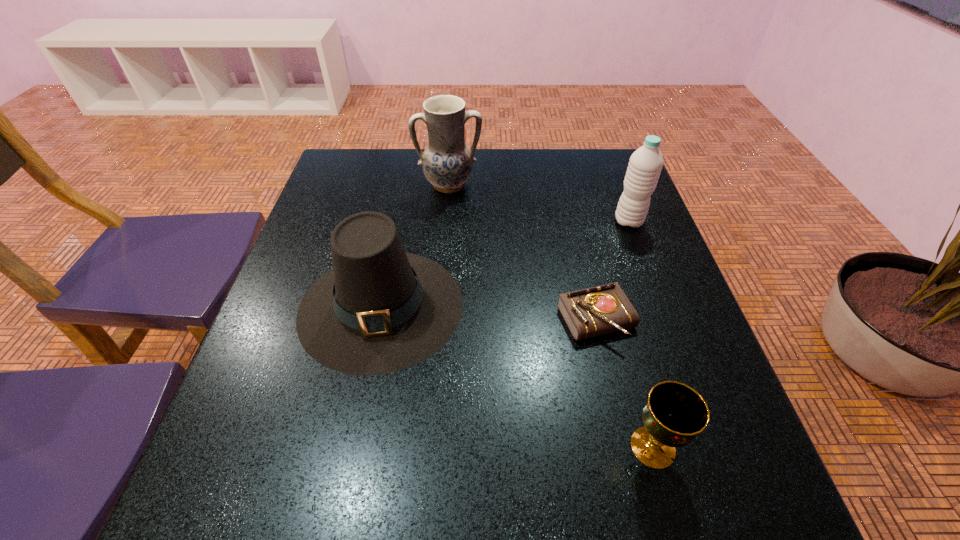
Locate an element on the screen. free space located 0.340m on the left of the chalice is located at coordinates (418, 447).

Image resolution: width=960 pixels, height=540 pixels. In order to click on free location located on the front of the diary in this screenshot , I will do `click(612, 389)`.

I want to click on object positioned at the far edge, so click(447, 162).

Where is `object that is at the near edge`? object that is at the near edge is located at coordinates (674, 414).

Identify the location of object at the left edge. This screenshot has height=540, width=960. (379, 310).

What are the coordinates of `water bottle located in the right edge section of the desktop` in the screenshot? It's located at (645, 165).

At what (x,y) coordinates should I click in order to perform the action: click on chalice at the right edge. Please return your answer as a coordinate pair (x, y). This screenshot has height=540, width=960. Looking at the image, I should click on (674, 414).

Identify the location of diary that is at the right edge. (604, 309).

Locate an element on the screen. The image size is (960, 540). object that is at the near right corner is located at coordinates (674, 414).

Locate an element on the screen. This screenshot has width=960, height=540. vacant space at the far edge of the desktop is located at coordinates (408, 161).